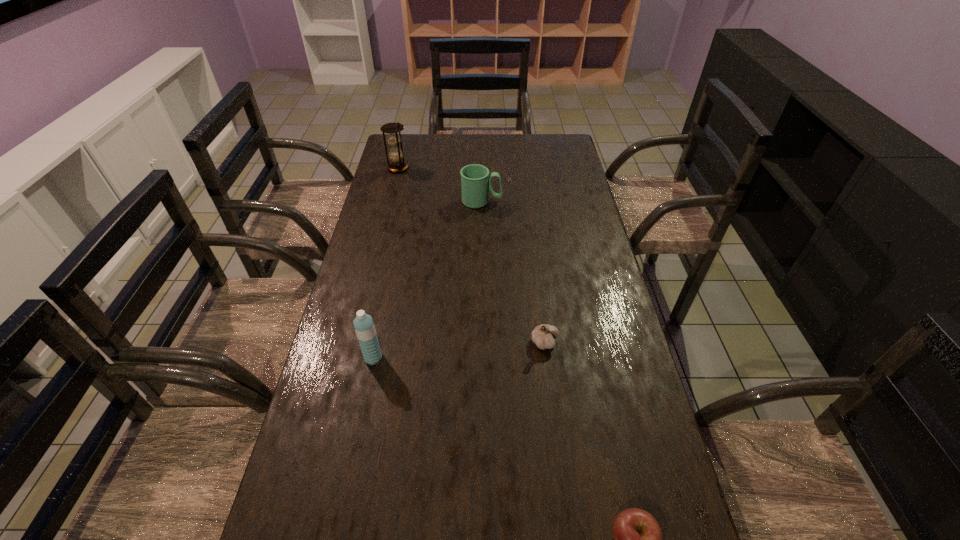
At what (x,y) coordinates should I click in order to perform the action: click on the farthest object. Please return your answer as a coordinate pair (x, y). This screenshot has height=540, width=960. Looking at the image, I should click on (398, 164).

This screenshot has height=540, width=960. What are the coordinates of `water bottle` in the screenshot? It's located at (364, 326).

This screenshot has width=960, height=540. Find the location of `the third shortest object`. the third shortest object is located at coordinates (475, 181).

You are a GUI agent. You are given a task and a screenshot of the screen. Output one action in this format:
    pyautogui.click(x=<x>, y=<y>)
    Task: Click on the mug
    This screenshot has height=540, width=960.
    Given the screenshot: What is the action you would take?
    pyautogui.click(x=475, y=181)

Find the location of a particular element. the fourth object from left to right is located at coordinates (543, 336).

This screenshot has width=960, height=540. In order to click on free spot located 0.170m on the front of the farthest object in this screenshot , I will do `click(391, 199)`.

What are the coordinates of `vacant space located on the front of the water bottle` in the screenshot? It's located at (348, 483).

The height and width of the screenshot is (540, 960). I want to click on vacant space located 0.160m on the side of the third shortest object with the handle, so click(545, 201).

I want to click on vacant area located on the back of the garlic, so click(540, 299).

This screenshot has width=960, height=540. I want to click on object that is at the far edge, so click(x=398, y=164).